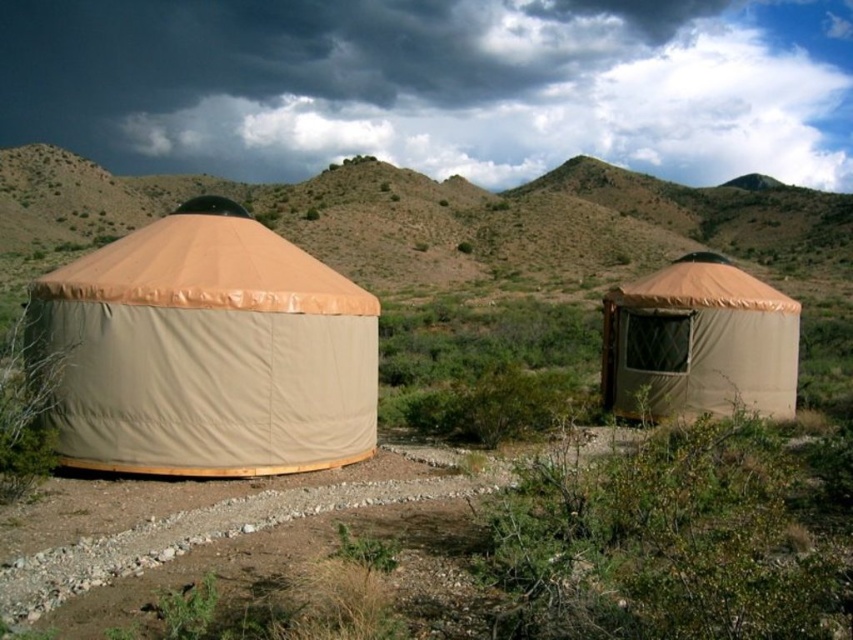
You are planning to set up a campsite in the desert and need to choose between the brown textured tent at upper center and the tan canvas yurt at right. Based on their sizes, which one would provide more space for your group?

The brown textured tent at upper center is bigger than the tan canvas yurt at right, so it would provide more space for your group.

You are standing in the desert and want to walk to the tan canvas yurt at right. Which yurt should you approach first if you need to pass by the brown textured tent at upper center?

You should approach the brown textured tent at upper center first because it is closer to you than the tan canvas yurt at right, so you must pass by it on your way to the yurt.